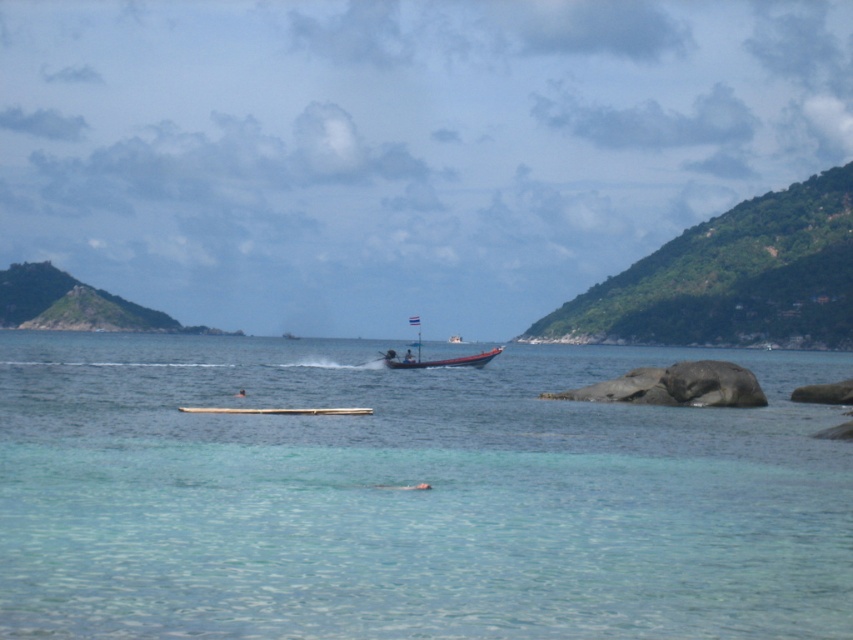
Can you confirm if clear water at center is smaller than red plastic boat at center?

Actually, clear water at center might be larger than red plastic boat at center.

Describe the element at coordinates (409, 497) in the screenshot. I see `clear water at center` at that location.

Locate an element on the screen. clear water at center is located at coordinates (409, 497).

Who is more forward, (494,353) or (387,362)?

Point (387,362) is more forward.

Locate an element on the screen. The width and height of the screenshot is (853, 640). wooden boat at center is located at coordinates (437, 358).

Describe the element at coordinates (437, 358) in the screenshot. This screenshot has height=640, width=853. I see `wooden boat at center` at that location.

You are a GUI agent. You are given a task and a screenshot of the screen. Output one action in this format:
    pyautogui.click(x=<x>, y=<y>)
    Task: Click on the wooden boat at center
    
    Given the screenshot: What is the action you would take?
    pyautogui.click(x=437, y=358)

Can you confirm if clear water at center is smaller than wooden boat at center?

No, clear water at center is not smaller than wooden boat at center.

Is point (422, 564) less distant than point (390, 368)?

That is True.

What do you see at coordinates (409, 497) in the screenshot? I see `clear water at center` at bounding box center [409, 497].

Where is `clear water at center`? clear water at center is located at coordinates (409, 497).